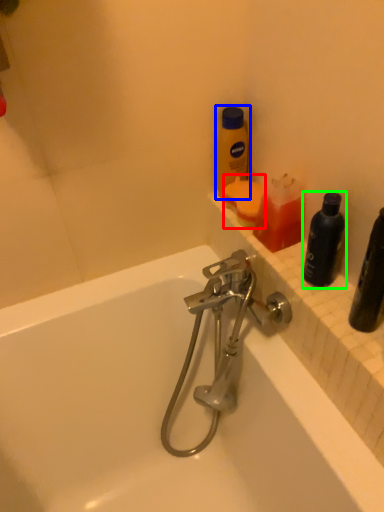
Question: Based on their relative distances, which object is nearer to cleaning product (highlighted by a red box)? Choose from bottle (highlighted by a blue box) and bottle (highlighted by a green box).

Choices:
 (A) bottle
 (B) bottle

Answer: (A)